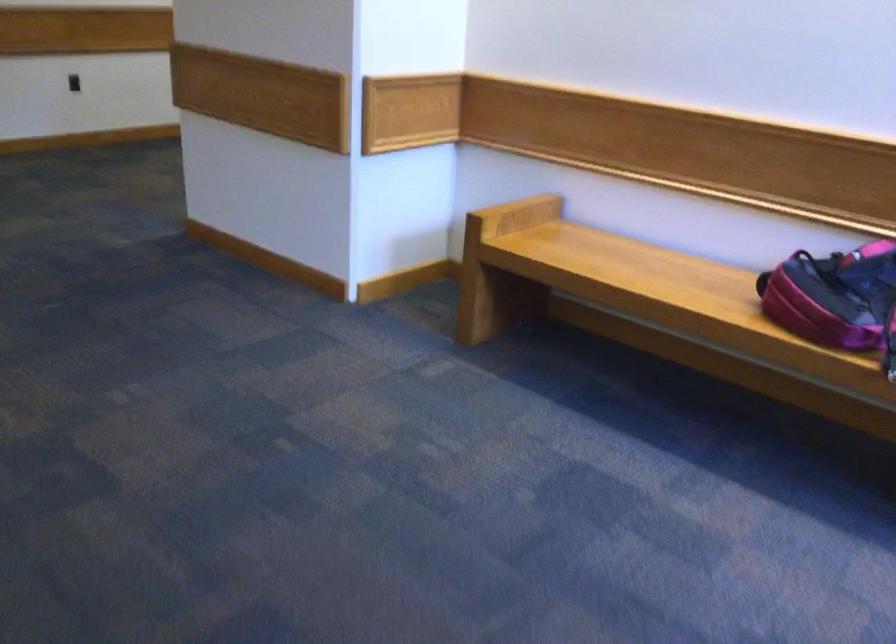
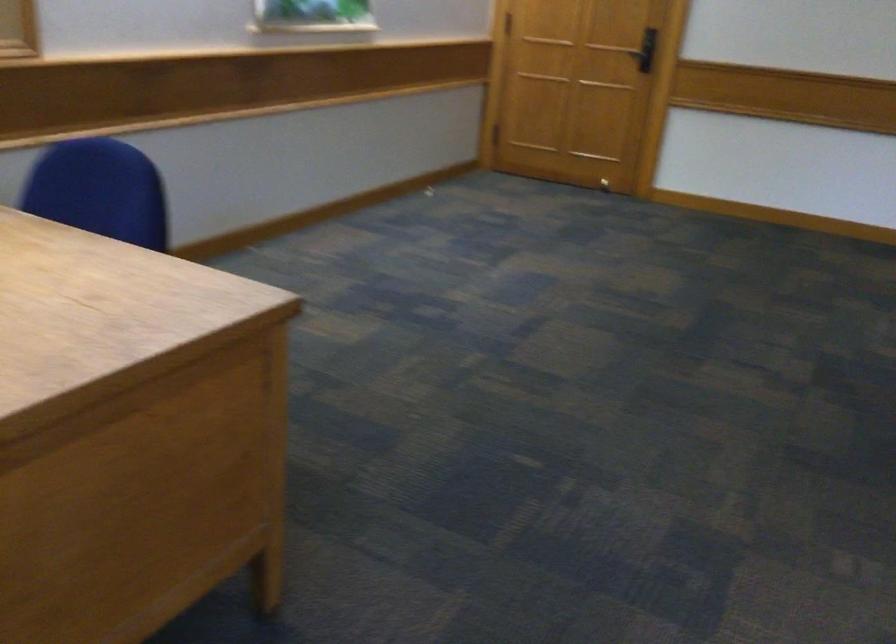
Question: How did the camera likely rotate?

Choices:
 (A) Left
 (B) Right
 (C) Up
 (D) Down

Answer: (A)